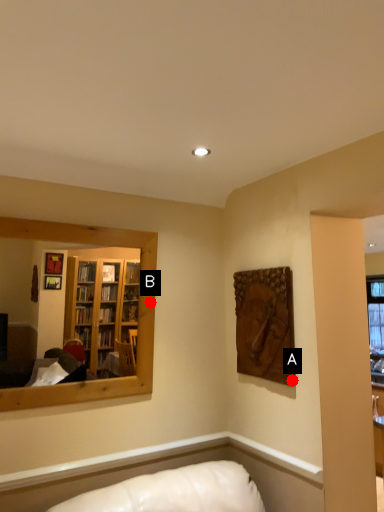
Question: Two points are circled on the image, labeled by A and B beside each circle. Which point is farther from the camera taking this photo?

Choices:
 (A) A is further
 (B) B is further

Answer: (B)